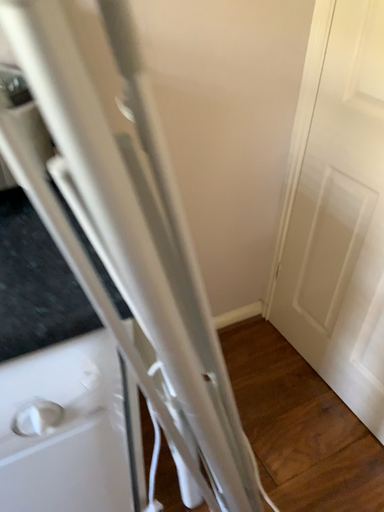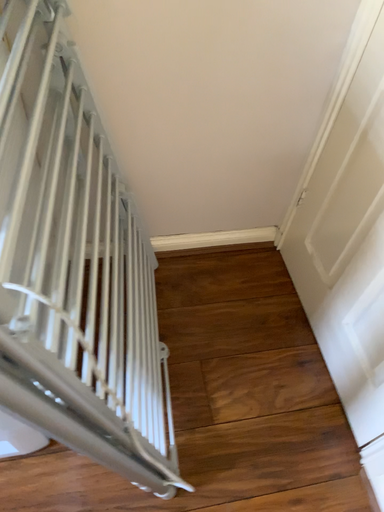
Question: How did the camera likely rotate when shooting the video?

Choices:
 (A) rotated right
 (B) rotated left

Answer: (B)